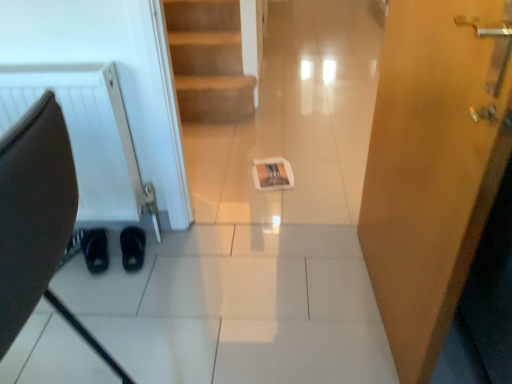
Where is `free area in between wooden door at right and white textured radiator at left`? The image size is (512, 384). free area in between wooden door at right and white textured radiator at left is located at coordinates (260, 286).